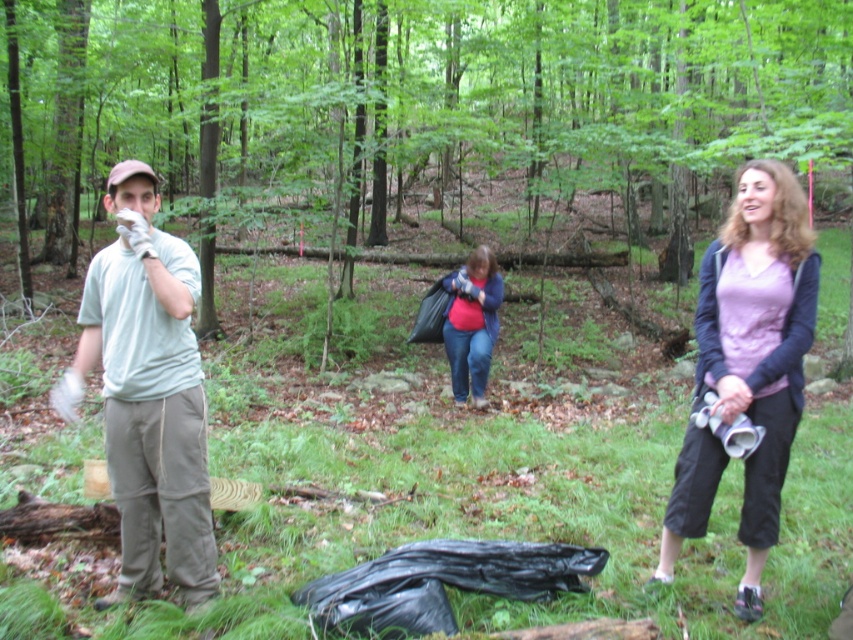
You are part of a community cleanup team in the forest. You see two volunteers wearing a matte purple shirt at center and a matte pink shirt at center. Which volunteer is standing to the right of the other?

The matte purple shirt at center is positioned on the right side of the matte pink shirt at center.

You are part of the cleanup crew and need to identify the volunteers based on their clothing. Which volunteer is wearing a smaller shirt between the matte purple shirt at center and the matte pink shirt at center?

The matte purple shirt at center is smaller than the matte pink shirt at center, so the volunteer wearing the matte purple shirt at center has the smaller shirt.

You are part of a community cleanup team in the forest. You see the green matte forest at center and the white cotton glove at left. Which object is higher up in the image?

The green matte forest at center is located above the white cotton glove at left, so the green matte forest at center is higher up in the image.